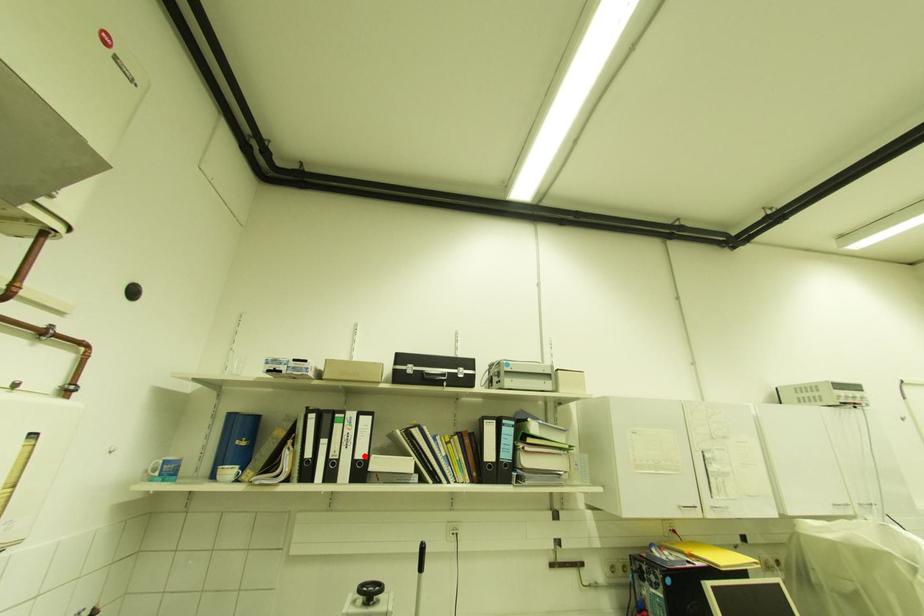
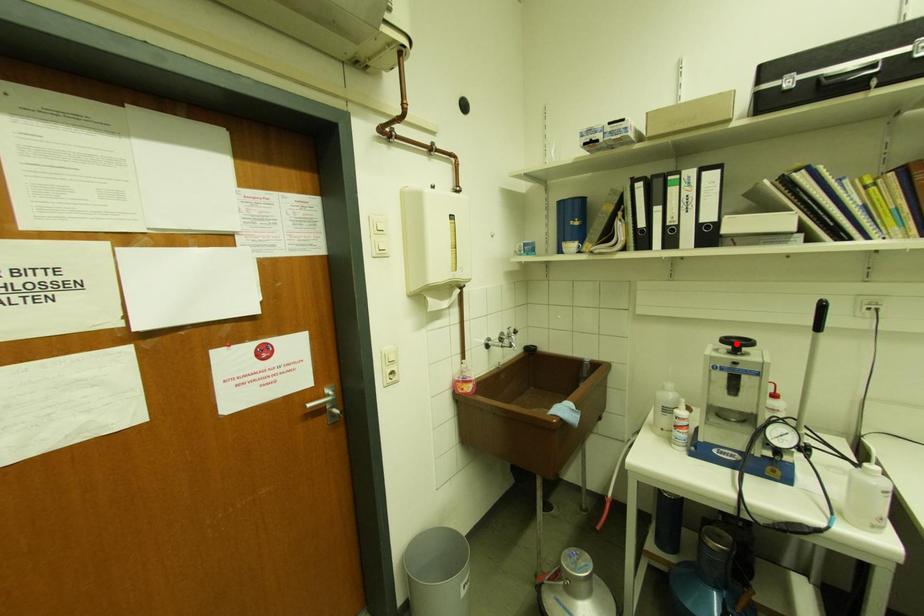
I am providing you with two images of the same scene from different viewpoints. A red point is marked on the first image and another point is marked on the second image. Do the highlighted points in image1 and image2 indicate the same real-world spot?

No